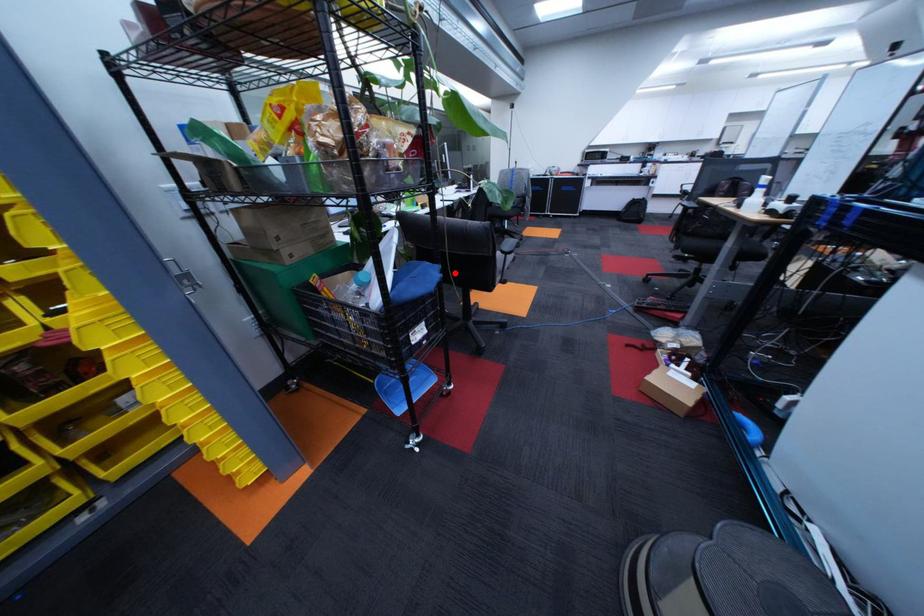
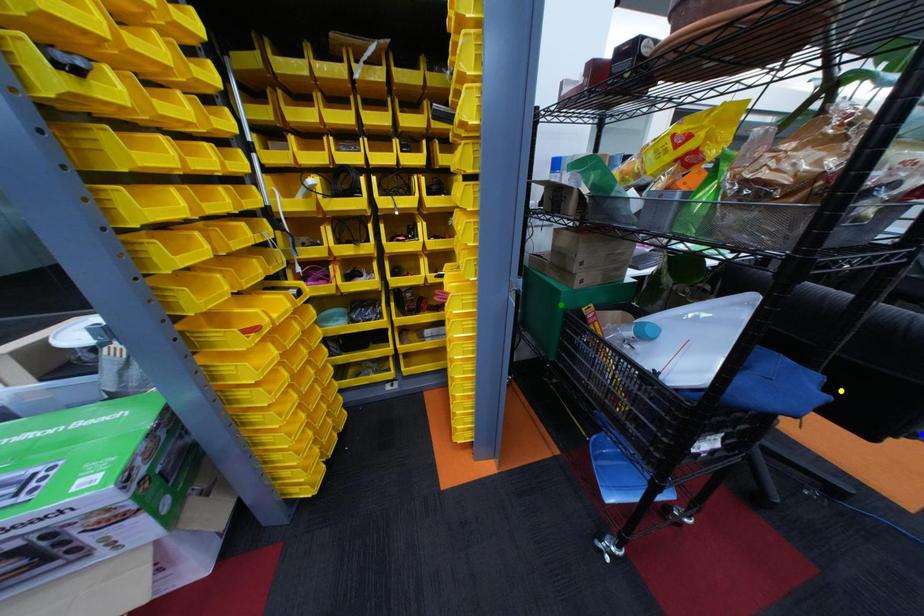
Question: I am providing you with two images of the same scene from different viewpoints. A red point is marked on the first image. You are given multiple points on the second image. In image 2, which mark is for the same physical point as the one in image 1?

Choices:
 (A) green point
 (B) yellow point
 (C) blue point

Answer: (B)